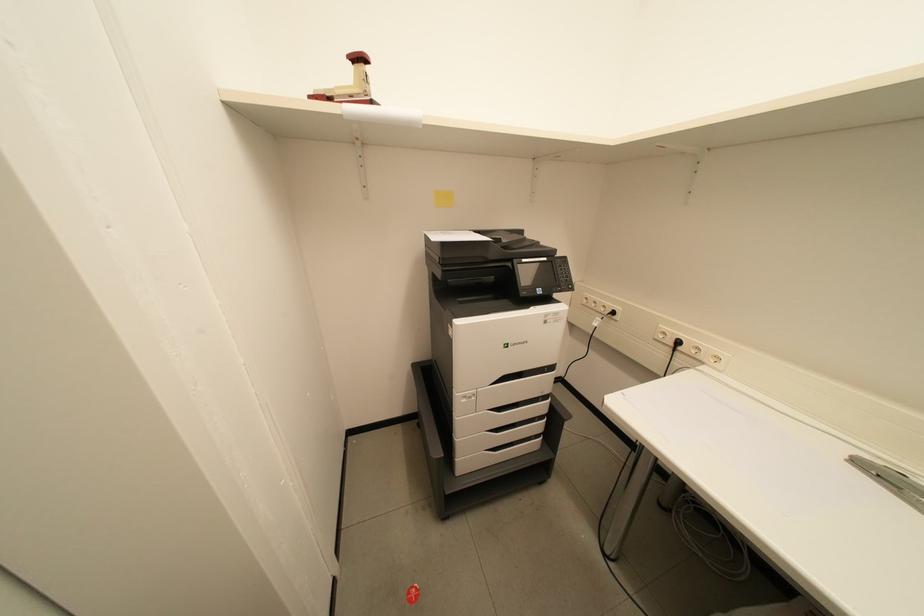
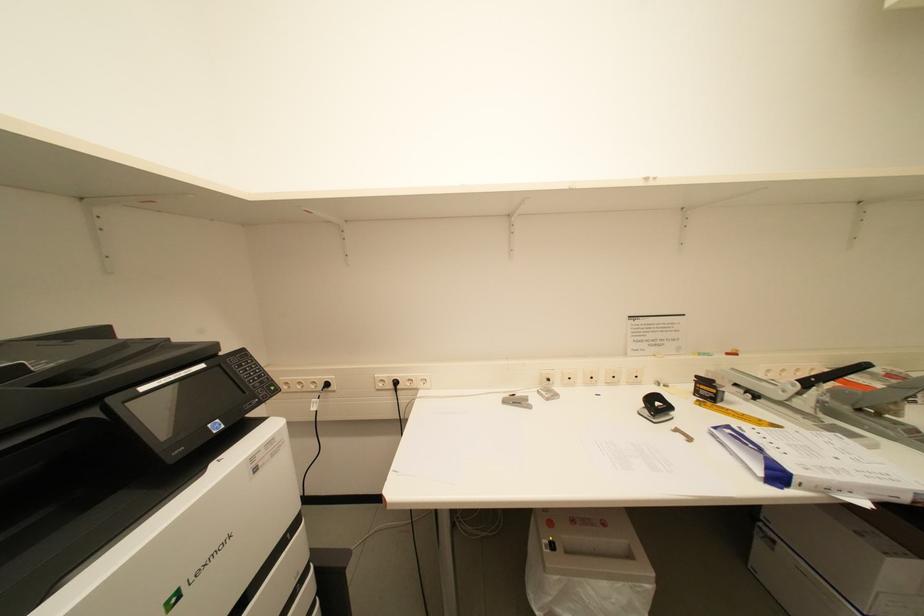
Question: Based on the continuous images, in which direction is the camera rotating? Reply with the corresponding letter.

Choices:
 (A) Left
 (B) Right
 (C) Up
 (D) Down

Answer: (B)